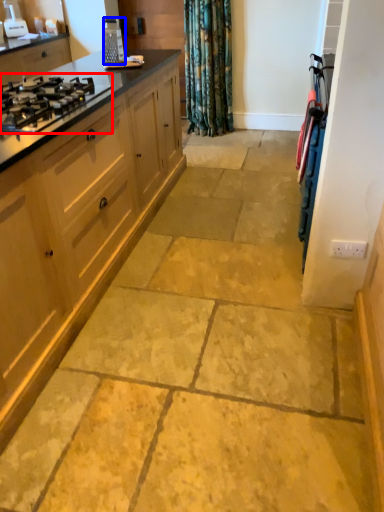
Question: Which of the following is the farthest to the observer, gas stove (highlighted by a red box) or appliance (highlighted by a blue box)?

Choices:
 (A) gas stove
 (B) appliance

Answer: (B)